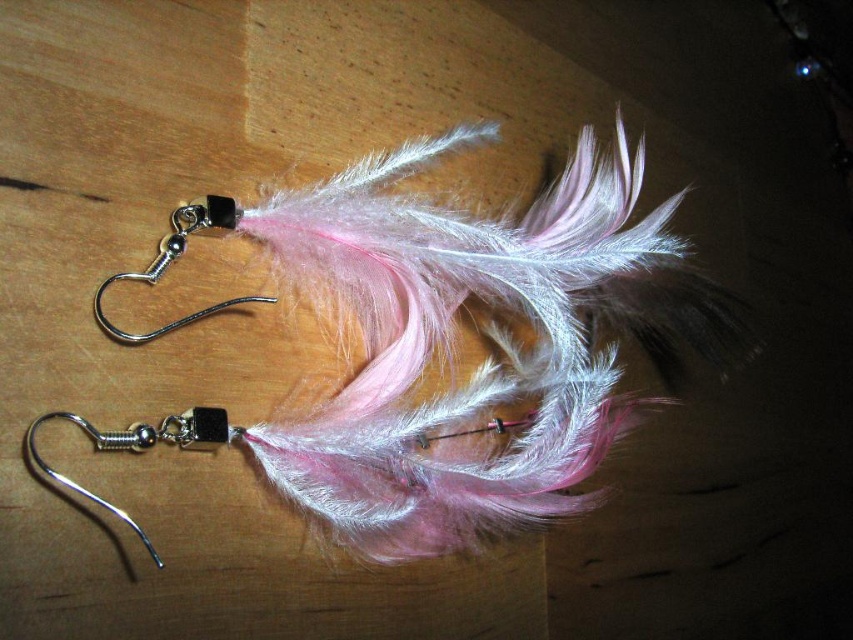
Question: From the image, what is the correct spatial relationship of silver/metallic hook at lower left in relation to silver/black metal hook at upper left?

Choices:
 (A) below
 (B) above

Answer: (A)

Question: Is silver/metallic hook at lower left bigger than silver/black metal hook at upper left?

Choices:
 (A) no
 (B) yes

Answer: (B)

Question: Where is silver/metallic hook at lower left located in relation to silver/black metal hook at upper left in the image?

Choices:
 (A) above
 (B) below

Answer: (B)

Question: Which point is farther to the camera?

Choices:
 (A) silver/black metal hook at upper left
 (B) silver/metallic hook at lower left

Answer: (A)